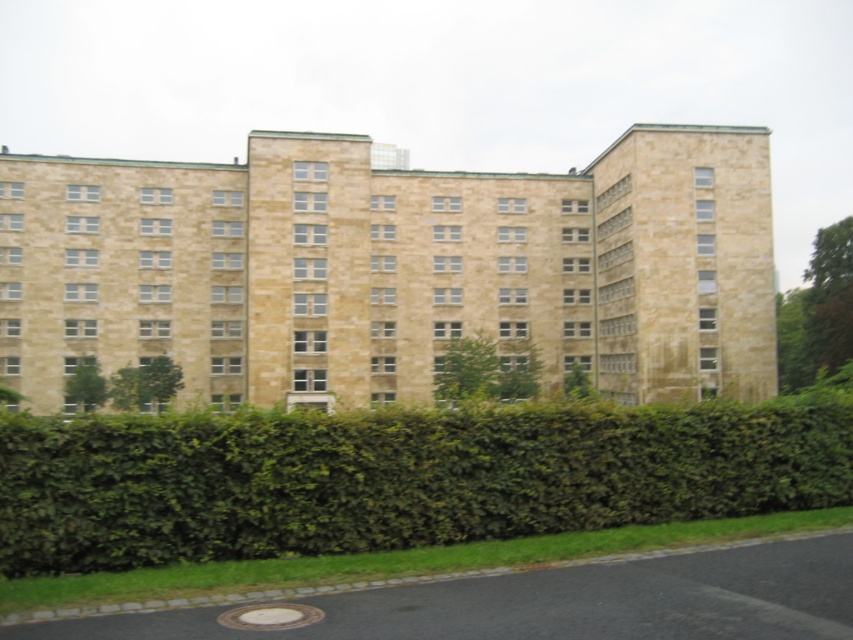
Question: Does green leafy bush at center appear on the left side of green leafy bush at left?

Choices:
 (A) no
 (B) yes

Answer: (A)

Question: Considering the relative positions of green leafy hedge at lower center and green leafy bush at left in the image provided, where is green leafy hedge at lower center located with respect to green leafy bush at left?

Choices:
 (A) left
 (B) right

Answer: (B)

Question: Which object appears closest to the camera in this image?

Choices:
 (A) green leafy hedge at lower center
 (B) green leafy bush at center

Answer: (A)

Question: Which of these objects is positioned farthest from the green leafy hedge at lower center?

Choices:
 (A) green leafy bush at left
 (B) green leafy bush at center

Answer: (A)

Question: Which object is positioned closest to the green leafy bush at center?

Choices:
 (A) green leafy bush at left
 (B) green leafy hedge at lower center

Answer: (A)

Question: Is green leafy bush at center closer to camera compared to green leafy bush at left?

Choices:
 (A) no
 (B) yes

Answer: (B)